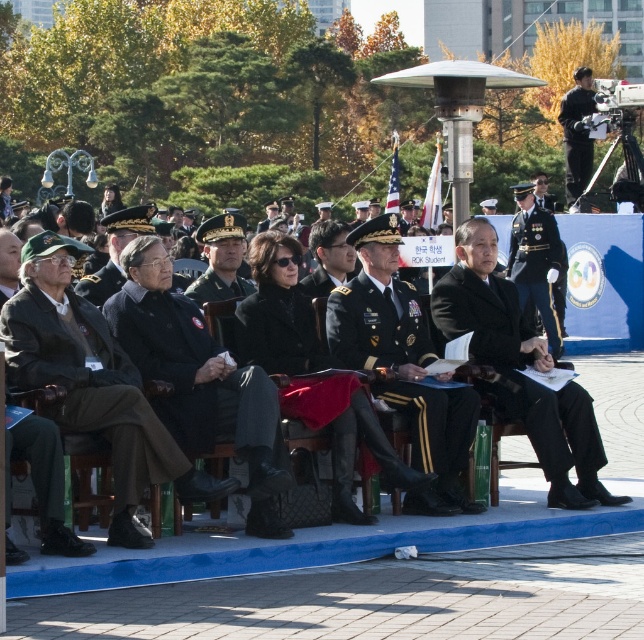
The height and width of the screenshot is (640, 644). I want to click on green felt hat at left, so point(43,483).

Is green felt hat at left smaller than black matte uniform at upper right?

Indeed, green felt hat at left has a smaller size compared to black matte uniform at upper right.

Locate an element on the screen. The width and height of the screenshot is (644, 640). green felt hat at left is located at coordinates (43, 483).

The height and width of the screenshot is (640, 644). Describe the element at coordinates (91, 384) in the screenshot. I see `dark brown wool coat at center` at that location.

Is dark brown wool coat at center positioned before black matte suit at center?

Yes, dark brown wool coat at center is in front of black matte suit at center.

At what (x,y) coordinates should I click in order to perform the action: click on dark brown wool coat at center. Please return your answer as a coordinate pair (x, y). This screenshot has height=640, width=644. Looking at the image, I should click on (91, 384).

This screenshot has height=640, width=644. I want to click on dark brown wool coat at center, so click(91, 384).

Can you confirm if dark gray uniform at center is positioned above black matte suit at center?

No.

Can you confirm if dark gray uniform at center is smaller than black matte suit at center?

Yes, dark gray uniform at center is smaller than black matte suit at center.

Between point (359, 314) and point (502, 394), which one is positioned behind?

Point (502, 394)

The height and width of the screenshot is (640, 644). I want to click on dark gray uniform at center, so click(x=402, y=365).